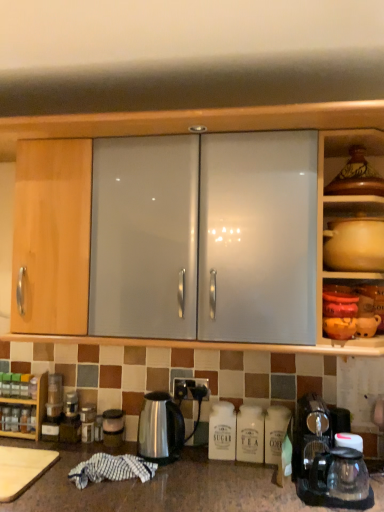
Question: From the image's perspective, is satin silver canister at lower center, placed as the first appliance when sorted from right to left, above or below brown matte vase at upper right?

Choices:
 (A) below
 (B) above

Answer: (A)

Question: Considering the positions of satin silver canister at lower center, placed as the first appliance when sorted from right to left, and brown matte vase at upper right in the image, is satin silver canister at lower center, placed as the first appliance when sorted from right to left, bigger or smaller than brown matte vase at upper right?

Choices:
 (A) big
 (B) small

Answer: (B)

Question: Estimate the real-world distances between objects in this image. Which object is closer to the satin black socket at center?

Choices:
 (A) white glossy towel at lower left
 (B) satin silver canister at lower center, placed as the first appliance when sorted from right to left
 (C) transparent glass coffee machine at lower right
 (D) satin silver kettle at center
 (E) satin silver kettle at lower left, acting as the second appliance starting from the right

Answer: (D)

Question: Which object is the farthest from the satin silver kettle at center?

Choices:
 (A) transparent glass coffee machine at lower right
 (B) matte ceramic pot at upper right, the 1th cabinetry from the right
 (C) satin silver canister at lower center, placed as the second appliance when sorted from left to right
 (D) matte brown pot at upper right
 (E) wooden spice rack at lower left, the 2th cabinetry from the top

Answer: (D)